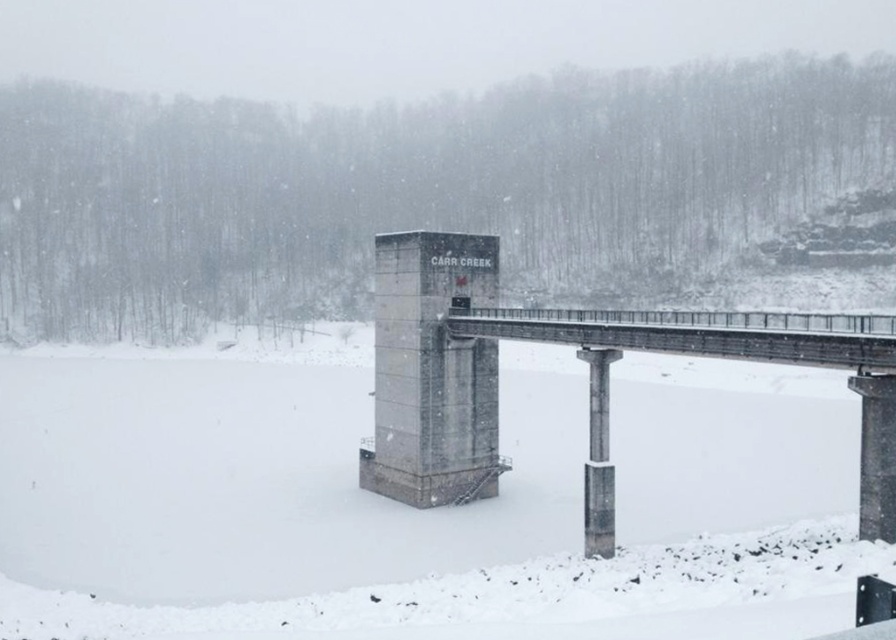
Question: Which of the following is the closest to the observer?

Choices:
 (A) (442, 390)
 (B) (840, 484)

Answer: (A)

Question: Which object appears closest to the camera in this image?

Choices:
 (A) white matte snow at center
 (B) concrete bridge at center

Answer: (A)

Question: Does white matte snow at center have a lesser width compared to concrete bridge at center?

Choices:
 (A) no
 (B) yes

Answer: (A)

Question: Can you confirm if white matte snow at center is wider than concrete bridge at center?

Choices:
 (A) no
 (B) yes

Answer: (B)

Question: Is white matte snow at center further to camera compared to concrete bridge at center?

Choices:
 (A) no
 (B) yes

Answer: (A)